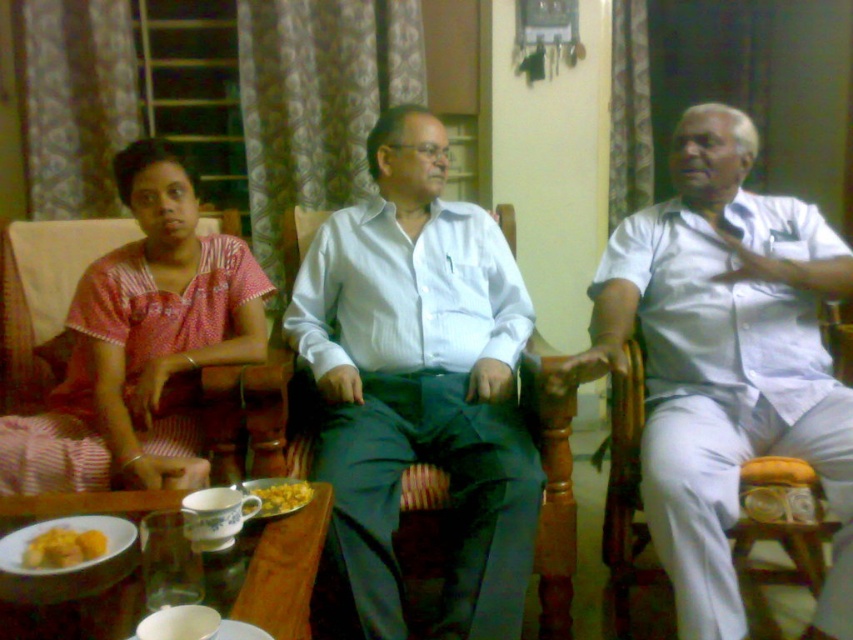
Question: Which point is farther to the camera?

Choices:
 (A) (231, 333)
 (B) (248, 481)
 (C) (287, 618)
 (D) (312, 268)

Answer: (D)

Question: Can you confirm if white cotton shirt at center is positioned below white glossy table at lower left?

Choices:
 (A) yes
 (B) no

Answer: (B)

Question: Which of the following is the closest to the observer?

Choices:
 (A) (36, 561)
 (B) (273, 513)
 (C) (300, 627)

Answer: (C)

Question: Can you confirm if yellow matte bread at lower left is positioned above yellow matte food at center?

Choices:
 (A) yes
 (B) no

Answer: (B)

Question: Which object appears closest to the camera in this image?

Choices:
 (A) yellow matte food at center
 (B) white glossy table at lower left
 (C) white smooth shirt at center

Answer: (B)

Question: Is pink striped dress at left to the left of yellow matte bread at lower left from the viewer's perspective?

Choices:
 (A) no
 (B) yes

Answer: (B)